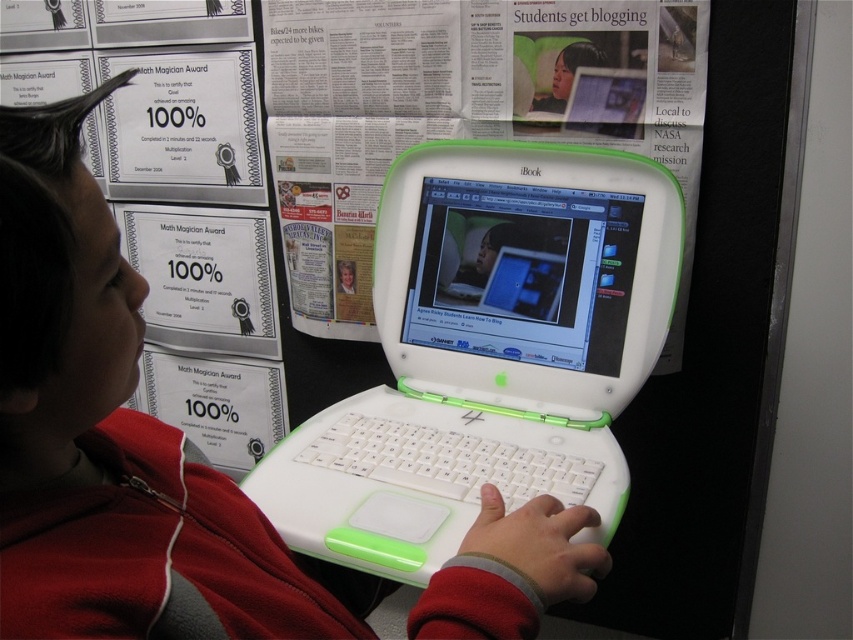
You are a photographer taking a picture of the scene. You want to focus on both the matte white jacket at center and the white plastic laptop at upper center. Which object should you adjust the focus on first to ensure both are in sharp focus?

You should focus on the matte white jacket at center first because it is closer to the viewer than the white plastic laptop at upper center. By focusing on the closer object, the depth of field may naturally include the farther object in acceptable focus.

You are a photographer taking a picture of the scene. The white plastic laptop at center and the matte white jacket at center are both in your view. Which object is positioned higher in the frame?

The white plastic laptop at center is located above the matte white jacket at center, so it is positioned higher in the frame.